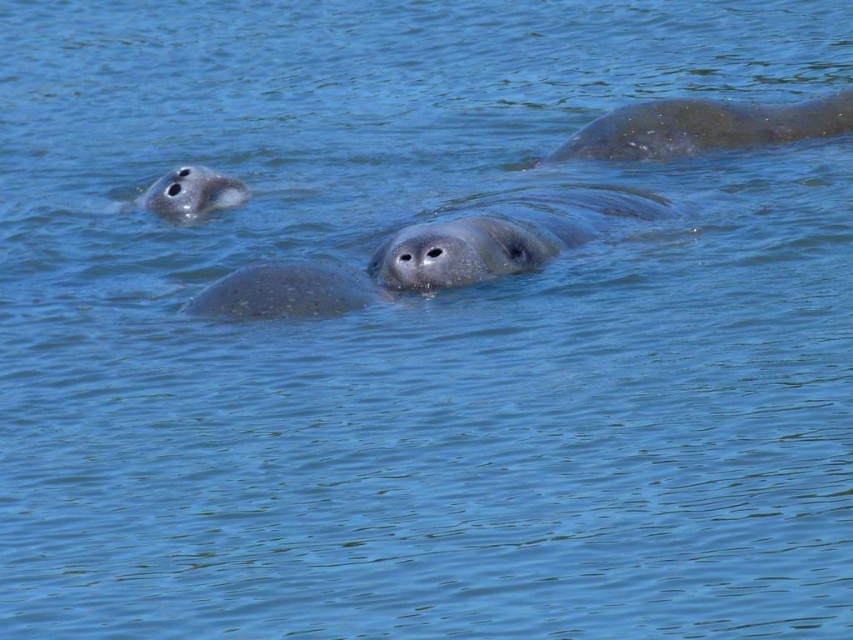
Question: Observing the image, what is the correct spatial positioning of gray matte seal at center in reference to gray matte seal at upper left?

Choices:
 (A) above
 (B) below

Answer: (B)

Question: Does gray matte seal at center have a larger size compared to gray matte seal at upper left?

Choices:
 (A) yes
 (B) no

Answer: (A)

Question: Based on their relative distances, which object is farther from the smooth gray seal at center?

Choices:
 (A) gray matte seal at upper left
 (B) gray matte seal at upper right

Answer: (B)

Question: Which point is closer to the camera?

Choices:
 (A) (425, 246)
 (B) (189, 173)

Answer: (A)

Question: Which object is farther from the camera taking this photo?

Choices:
 (A) gray matte seal at center
 (B) smooth gray seal at center

Answer: (A)

Question: Can you confirm if smooth gray seal at center is wider than gray matte seal at upper left?

Choices:
 (A) no
 (B) yes

Answer: (B)